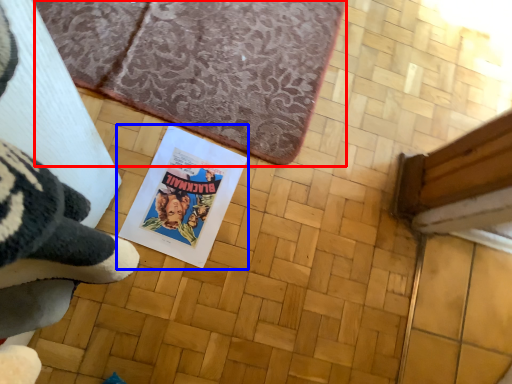
Question: Among these objects, which one is nearest to the camera, bath mat (highlighted by a red box) or paperback book (highlighted by a blue box)?

Choices:
 (A) bath mat
 (B) paperback book

Answer: (B)